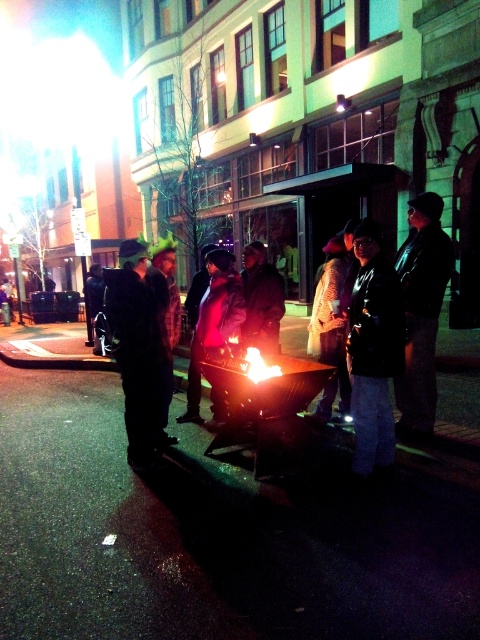
You are organizing a winter photoshoot and need to ensure that the black matte jacket at center and dark gray knit hat at center are both visible in the frame. Given their sizes, which object should you prioritize positioning closer to the camera to ensure visibility?

The black matte jacket at center should be positioned closer to the camera because it occupies less space than the dark gray knit hat at center, making it smaller and potentially harder to see from a distance.

Based on the photo, you are a photographer trying to capture the group around the fire pit. You want to ensure both the black matte jacket at center and the dark gray knit hat at center are clearly visible in your shot. Since you can only focus on one subject at a time, which one should you focus on to ensure both are in focus?

You should focus on the dark gray knit hat at center because the black matte jacket at center is to the right of it, so focusing on the closer object will keep both in focus.